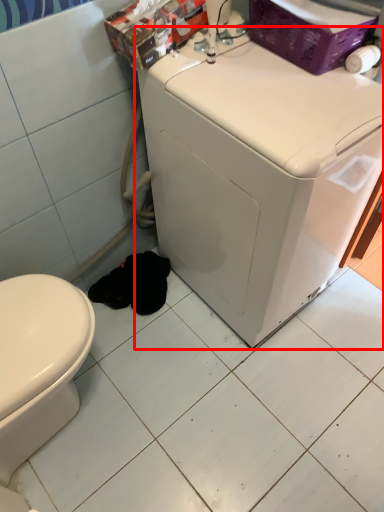
Question: Where is washing machine (annotated by the red box) located in relation to ceramic tile in the image?

Choices:
 (A) left
 (B) right

Answer: (B)